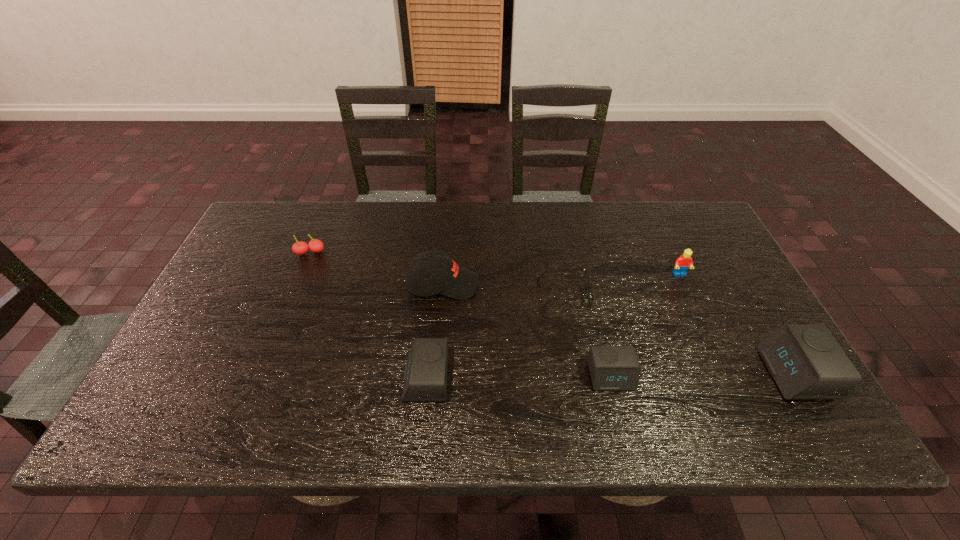
I want to click on free space at the near right corner of the desktop, so click(x=748, y=387).

I want to click on free space between the Lego and the baseball cap, so click(x=562, y=280).

Where is `free space between the Lego and the rightmost object`? Image resolution: width=960 pixels, height=540 pixels. free space between the Lego and the rightmost object is located at coordinates (737, 324).

Locate an element on the screen. This screenshot has width=960, height=540. empty location between the rightmost alarm clock and the spectacles is located at coordinates (679, 334).

I want to click on empty space between the sixth object from left to right and the baseball cap, so click(562, 280).

Image resolution: width=960 pixels, height=540 pixels. I want to click on free space between the baseball cap and the spectacles, so 503,289.

Identify the location of free point between the second object from right to left and the farthest object. (495, 264).

Image resolution: width=960 pixels, height=540 pixels. I want to click on vacant area that lies between the second object from right to left and the tallest alarm clock, so click(737, 324).

Where is `free space between the baseball cap and the shortest alarm clock`? Image resolution: width=960 pixels, height=540 pixels. free space between the baseball cap and the shortest alarm clock is located at coordinates pyautogui.click(x=527, y=330).

Find the location of a particular element. This screenshot has width=960, height=540. vacant area that lies between the rightmost alarm clock and the Lego is located at coordinates (737, 324).